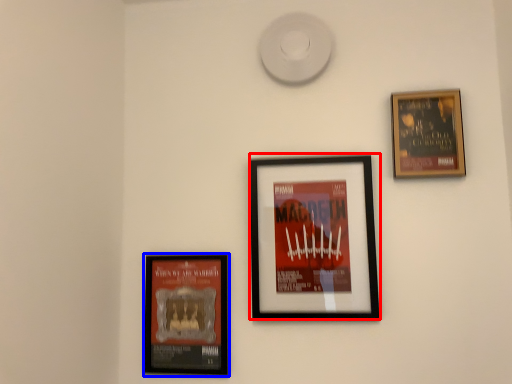
Question: Which of the following is the closest to the observer, picture frame (highlighted by a red box) or picture frame (highlighted by a blue box)?

Choices:
 (A) picture frame
 (B) picture frame

Answer: (A)